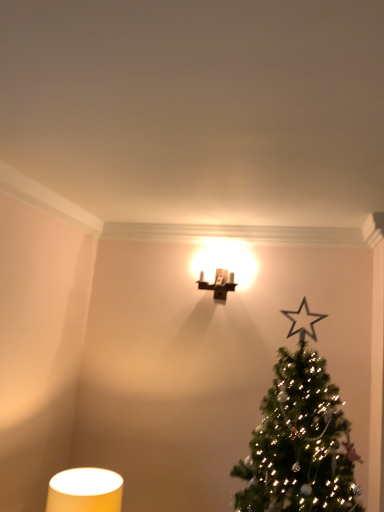
Question: Considering the relative positions of matte yellow cylindrical lampshade at lower left, placed as the first table lamp when sorted from bottom to top, and matte brown wall sconce at upper center, positioned as the second table lamp in left-to-right order, in the image provided, is matte yellow cylindrical lampshade at lower left, placed as the first table lamp when sorted from bottom to top, to the left of matte brown wall sconce at upper center, positioned as the second table lamp in left-to-right order, from the viewer's perspective?

Choices:
 (A) yes
 (B) no

Answer: (A)

Question: From the image's perspective, would you say matte yellow cylindrical lampshade at lower left, acting as the 2th table lamp starting from the right, is shown under matte brown wall sconce at upper center, the 2th table lamp when ordered from bottom to top?

Choices:
 (A) no
 (B) yes

Answer: (B)

Question: Is the position of matte yellow cylindrical lampshade at lower left, acting as the 2th table lamp starting from the right, less distant than that of matte brown wall sconce at upper center, marked as the first table lamp in a top-to-bottom arrangement?

Choices:
 (A) no
 (B) yes

Answer: (B)

Question: Can you confirm if matte yellow cylindrical lampshade at lower left, placed as the 1th table lamp when sorted from left to right, is shorter than matte brown wall sconce at upper center, which is the second table lamp in front-to-back order?

Choices:
 (A) no
 (B) yes

Answer: (A)

Question: Could you tell me if matte yellow cylindrical lampshade at lower left, placed as the first table lamp when sorted from bottom to top, is turned towards matte brown wall sconce at upper center, the 2th table lamp when ordered from bottom to top?

Choices:
 (A) yes
 (B) no

Answer: (B)

Question: Are matte yellow cylindrical lampshade at lower left, which appears as the second table lamp when viewed from the top, and matte brown wall sconce at upper center, placed as the 1th table lamp when sorted from back to front, far apart?

Choices:
 (A) yes
 (B) no

Answer: (A)

Question: Is green matte christmas tree at upper right at the right side of matte brown wall sconce at upper center, placed as the 1th table lamp when sorted from back to front?

Choices:
 (A) yes
 (B) no

Answer: (A)

Question: Can you confirm if green matte christmas tree at upper right is wider than matte brown wall sconce at upper center, positioned as the second table lamp in left-to-right order?

Choices:
 (A) no
 (B) yes

Answer: (B)

Question: Does green matte christmas tree at upper right have a lesser height compared to matte brown wall sconce at upper center, marked as the first table lamp in a top-to-bottom arrangement?

Choices:
 (A) yes
 (B) no

Answer: (B)

Question: Considering the relative sizes of green matte christmas tree at upper right and matte brown wall sconce at upper center, placed as the 1th table lamp when sorted from back to front, in the image provided, is green matte christmas tree at upper right thinner than matte brown wall sconce at upper center, placed as the 1th table lamp when sorted from back to front,?

Choices:
 (A) yes
 (B) no

Answer: (B)

Question: From a real-world perspective, is green matte christmas tree at upper right physically below matte brown wall sconce at upper center, the 2th table lamp when ordered from bottom to top?

Choices:
 (A) no
 (B) yes

Answer: (B)

Question: Considering the relative positions of green matte christmas tree at upper right and matte brown wall sconce at upper center, which is the second table lamp in front-to-back order, in the image provided, is green matte christmas tree at upper right behind matte brown wall sconce at upper center, which is the second table lamp in front-to-back order,?

Choices:
 (A) yes
 (B) no

Answer: (B)

Question: Is matte brown wall sconce at upper center, the 2th table lamp when ordered from bottom to top, further to camera compared to matte yellow cylindrical lampshade at lower left, which appears as the second table lamp when viewed from the top?

Choices:
 (A) no
 (B) yes

Answer: (B)